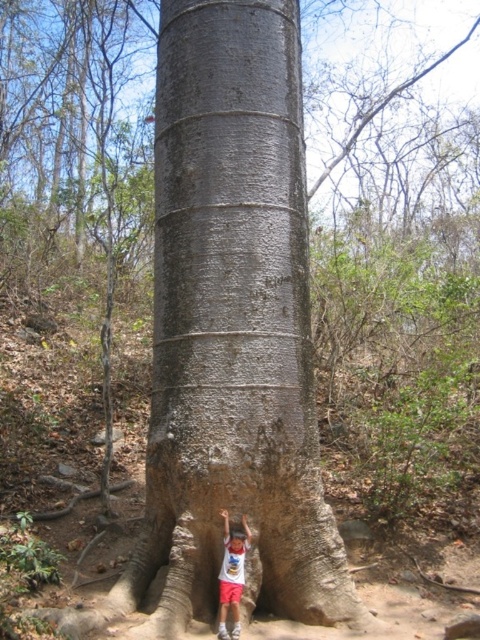
Question: Which point is closer to the camera taking this photo?

Choices:
 (A) (283, 513)
 (B) (236, 602)

Answer: (B)

Question: Among these objects, which one is farthest from the camera?

Choices:
 (A) matte white t-shirt at center
 (B) gray rough bark tree trunk at center

Answer: (A)

Question: Is gray rough bark tree trunk at center to the left of matte white t-shirt at center from the viewer's perspective?

Choices:
 (A) no
 (B) yes

Answer: (A)

Question: Does gray rough bark tree trunk at center lie behind matte white t-shirt at center?

Choices:
 (A) yes
 (B) no

Answer: (B)

Question: Observing the image, what is the correct spatial positioning of gray rough bark tree trunk at center in reference to matte white t-shirt at center?

Choices:
 (A) above
 (B) below

Answer: (A)